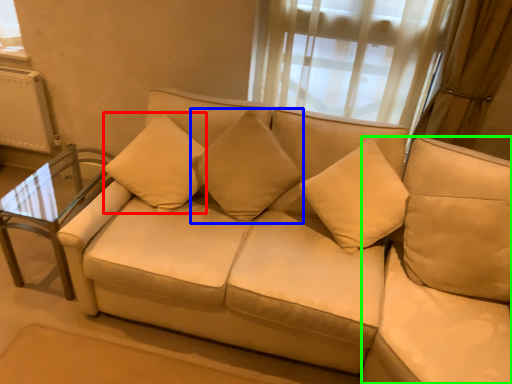
Question: Which is farther away from pillow (highlighted by a red box)? pillow (highlighted by a blue box) or beige (highlighted by a green box)?

Choices:
 (A) pillow
 (B) beige

Answer: (B)